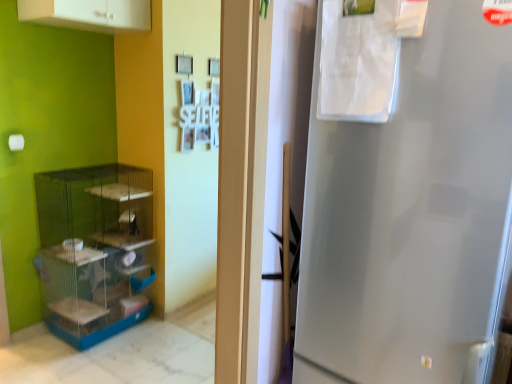
This screenshot has width=512, height=384. What do you see at coordinates (89, 14) in the screenshot?
I see `white matte cabinet at upper left` at bounding box center [89, 14].

Find the location of a particular element. Image resolution: width=512 pixels, height=384 pixels. white matte cabinet at upper left is located at coordinates (89, 14).

What is the approximate height of blue plastic shelf at left?

blue plastic shelf at left is 3.73 feet tall.

This screenshot has height=384, width=512. Describe the element at coordinates (95, 250) in the screenshot. I see `blue plastic shelf at left` at that location.

Measure the distance between blue plastic shelf at left and camera.

The depth of blue plastic shelf at left is 8.24 feet.

Identify the location of blue plastic shelf at left. 95,250.

Where is `white matte cabinet at upper left`? The height and width of the screenshot is (384, 512). white matte cabinet at upper left is located at coordinates (89, 14).

Visually, is blue plastic shelf at left positioned to the left or to the right of white matte cabinet at upper left?

blue plastic shelf at left is to the left of white matte cabinet at upper left.

Is the depth of blue plastic shelf at left less than that of white matte cabinet at upper left?

No, blue plastic shelf at left is further to the viewer.

Considering the points (65, 296) and (31, 11), which point is behind, point (65, 296) or point (31, 11)?

The point (65, 296) is more distant.

From the image's perspective, which is below, blue plastic shelf at left or white matte cabinet at upper left?

blue plastic shelf at left is shown below in the image.

From a real-world perspective, is blue plastic shelf at left over white matte cabinet at upper left?

Incorrect, from a real-world perspective, blue plastic shelf at left is lower than white matte cabinet at upper left.

Considering the relative sizes of blue plastic shelf at left and white matte cabinet at upper left in the image provided, is blue plastic shelf at left wider than white matte cabinet at upper left?

Correct, the width of blue plastic shelf at left exceeds that of white matte cabinet at upper left.

From their relative heights in the image, would you say blue plastic shelf at left is taller or shorter than white matte cabinet at upper left?

Considering their sizes, blue plastic shelf at left has more height than white matte cabinet at upper left.

Considering the sizes of blue plastic shelf at left and white matte cabinet at upper left in the image, is blue plastic shelf at left bigger or smaller than white matte cabinet at upper left?

blue plastic shelf at left is bigger than white matte cabinet at upper left.

Which is correct: blue plastic shelf at left is inside white matte cabinet at upper left, or outside of it?

blue plastic shelf at left exists outside the volume of white matte cabinet at upper left.

Can you see blue plastic shelf at left touching white matte cabinet at upper left?

blue plastic shelf at left and white matte cabinet at upper left are not in contact.

Could you tell me if blue plastic shelf at left is turned towards white matte cabinet at upper left?

No, blue plastic shelf at left is not aimed at white matte cabinet at upper left.

How many degrees apart are the facing directions of blue plastic shelf at left and white matte cabinet at upper left?

The angle between the facing direction of blue plastic shelf at left and the facing direction of white matte cabinet at upper left is 2.28 degrees.

Where is `cabinetry on the right of the blue plastic shelf at left`? The height and width of the screenshot is (384, 512). cabinetry on the right of the blue plastic shelf at left is located at coordinates (89, 14).

Considering the relative positions of white matte cabinet at upper left and blue plastic shelf at left in the image provided, is white matte cabinet at upper left to the left of blue plastic shelf at left from the viewer's perspective?

Incorrect, white matte cabinet at upper left is not on the left side of blue plastic shelf at left.

Does white matte cabinet at upper left come in front of blue plastic shelf at left?

Yes, it is in front of blue plastic shelf at left.

Is point (108, 8) positioned behind point (89, 293)?

No, (108, 8) is in front of (89, 293).

From the image's perspective, which one is positioned higher, white matte cabinet at upper left or blue plastic shelf at left?

white matte cabinet at upper left is shown above in the image.

From a real-world perspective, is white matte cabinet at upper left physically below blue plastic shelf at left?

No, from a real-world perspective, white matte cabinet at upper left is not beneath blue plastic shelf at left.

From the picture: Considering the relative sizes of white matte cabinet at upper left and blue plastic shelf at left in the image provided, is white matte cabinet at upper left wider than blue plastic shelf at left?

No.

Is white matte cabinet at upper left taller or shorter than blue plastic shelf at left?

Clearly, white matte cabinet at upper left is shorter compared to blue plastic shelf at left.

Which of these two, white matte cabinet at upper left or blue plastic shelf at left, is bigger?

blue plastic shelf at left is bigger.

Is white matte cabinet at upper left not inside blue plastic shelf at left?

Yes, white matte cabinet at upper left is not within blue plastic shelf at left.

Is white matte cabinet at upper left in contact with blue plastic shelf at left?

No, white matte cabinet at upper left is not touching blue plastic shelf at left.

Is white matte cabinet at upper left turned away from blue plastic shelf at left?

white matte cabinet at upper left is not turned away from blue plastic shelf at left.

How different are the orientations of white matte cabinet at upper left and blue plastic shelf at left in degrees?

They differ by 2.28 degrees in their facing directions.

Measure the distance between white matte cabinet at upper left and blue plastic shelf at left.

white matte cabinet at upper left and blue plastic shelf at left are 4.24 feet apart from each other.

Where is `cabinetry above the blue plastic shelf at left (from a real-world perspective)`? The image size is (512, 384). cabinetry above the blue plastic shelf at left (from a real-world perspective) is located at coordinates (89, 14).

This screenshot has height=384, width=512. What are the coordinates of `cabinetry above the blue plastic shelf at left (from a real-world perspective)` in the screenshot? It's located at (89, 14).

This screenshot has height=384, width=512. I want to click on cabinetry in front of the blue plastic shelf at left, so click(x=89, y=14).